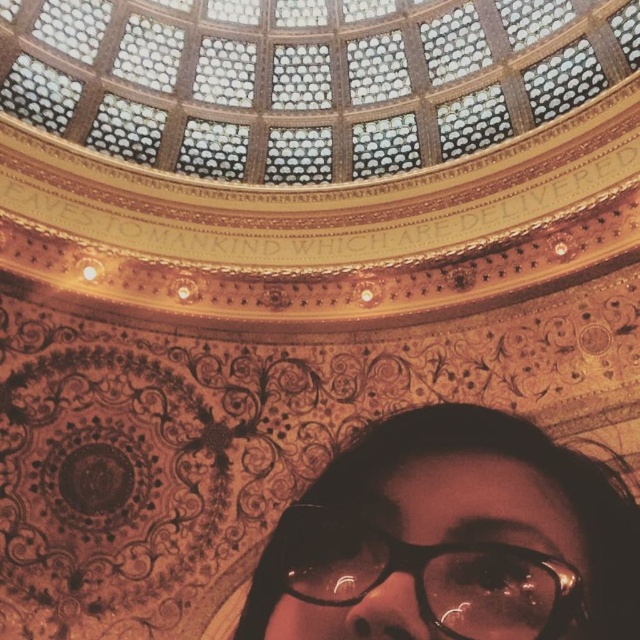
You are standing inside a grand dome structure with an ornate golden ceiling. You notice an object labeled matte black glasses at bottom. Where exactly is this object located in the dome?

The matte black glasses at bottom is located at point (x=451, y=540).

You are standing inside the dome and notice two pairs of glasses at the bottom of the image. Which pair of glasses is closer to you, the matte black glasses at bottom or the black plastic glasses at bottom?

The matte black glasses at bottom is closer to you because it is further to the viewer than the black plastic glasses at bottom.